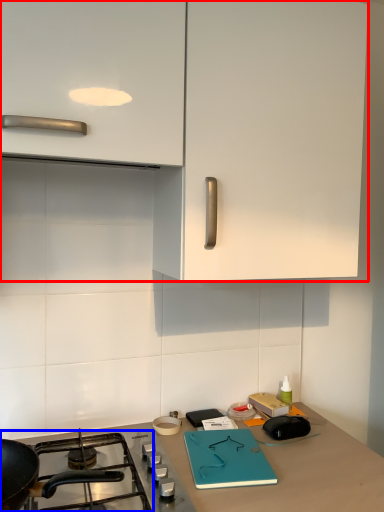
Question: Among these objects, which one is nearest to the camera, cabinetry (highlighted by a red box) or gas stove (highlighted by a blue box)?

Choices:
 (A) cabinetry
 (B) gas stove

Answer: (B)